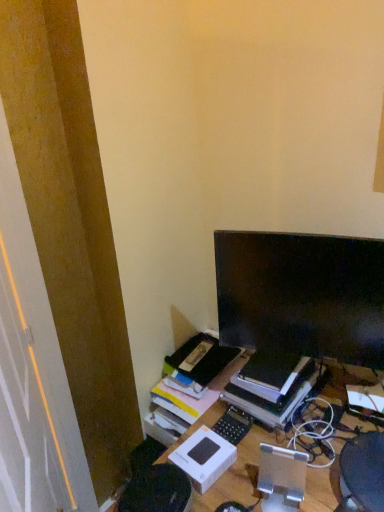
Question: Is black matte keyboard at center oriented away from white matte cardboard box at center?

Choices:
 (A) yes
 (B) no

Answer: (B)

Question: From a real-world perspective, does black matte keyboard at center sit lower than white matte cardboard box at center?

Choices:
 (A) no
 (B) yes

Answer: (B)

Question: Can you confirm if black matte keyboard at center is wider than white matte cardboard box at center?

Choices:
 (A) no
 (B) yes

Answer: (A)

Question: Is the depth of black matte keyboard at center less than that of white matte cardboard box at center?

Choices:
 (A) no
 (B) yes

Answer: (A)

Question: Can you confirm if black matte keyboard at center is positioned to the left of white matte cardboard box at center?

Choices:
 (A) yes
 (B) no

Answer: (B)

Question: Is point (218, 424) closer or farther from the camera than point (221, 471)?

Choices:
 (A) farther
 (B) closer

Answer: (A)

Question: From their relative heights in the image, would you say black matte keyboard at center is taller or shorter than white matte cardboard box at center?

Choices:
 (A) short
 (B) tall

Answer: (A)

Question: Relative to white matte cardboard box at center, is black matte keyboard at center in front or behind?

Choices:
 (A) front
 (B) behind

Answer: (B)

Question: Looking at the image, does black matte keyboard at center seem bigger or smaller compared to white matte cardboard box at center?

Choices:
 (A) big
 (B) small

Answer: (B)

Question: Is white matte cardboard box at center in front of or behind matte black monitor at upper right in the image?

Choices:
 (A) front
 (B) behind

Answer: (B)

Question: From a real-world perspective, relative to matte black monitor at upper right, is white matte cardboard box at center vertically above or below?

Choices:
 (A) below
 (B) above

Answer: (A)

Question: Based on their positions, is white matte cardboard box at center located to the left or right of matte black monitor at upper right?

Choices:
 (A) left
 (B) right

Answer: (A)

Question: Is white matte cardboard box at center wider or thinner than matte black monitor at upper right?

Choices:
 (A) thin
 (B) wide

Answer: (B)

Question: Considering their positions, is matte black monitor at upper right located in front of or behind black matte keyboard at center?

Choices:
 (A) behind
 (B) front

Answer: (B)

Question: Is point (317, 332) closer or farther from the camera than point (221, 428)?

Choices:
 (A) farther
 (B) closer

Answer: (B)